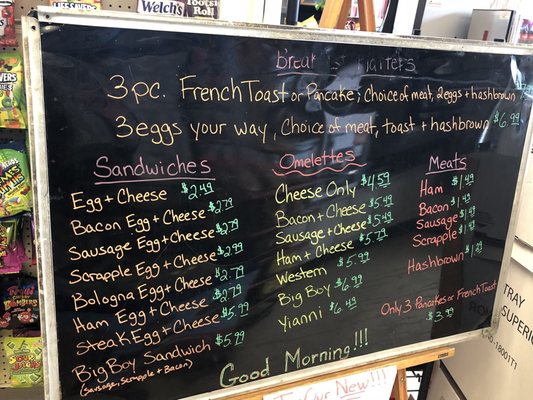
Find the location of a particular element. This screenshot has width=533, height=400. blackboard is located at coordinates (114, 64).